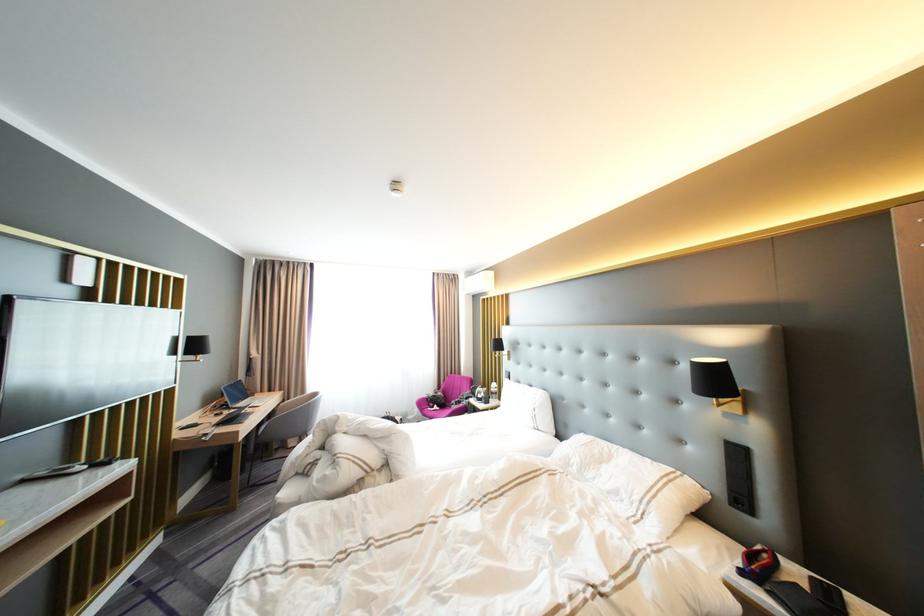
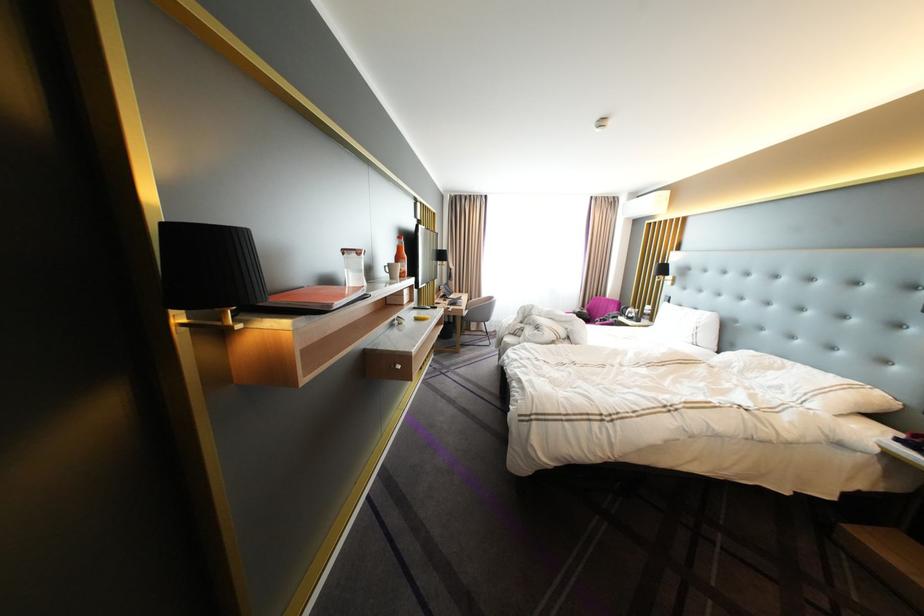
Where in the second image is the point corresponding to point (444, 397) from the first image?

(590, 313)